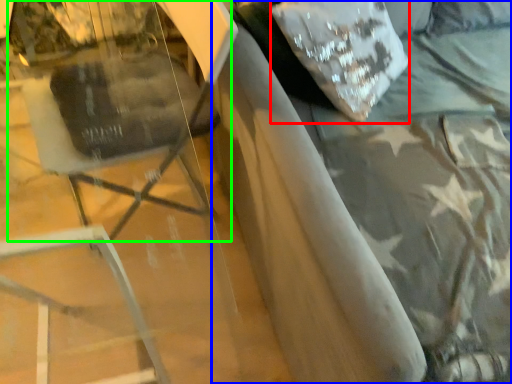
Question: Which is farther away from pillow (highlighted by a red box)? bed (highlighted by a blue box) or swivel chair (highlighted by a green box)?

Choices:
 (A) bed
 (B) swivel chair

Answer: (B)